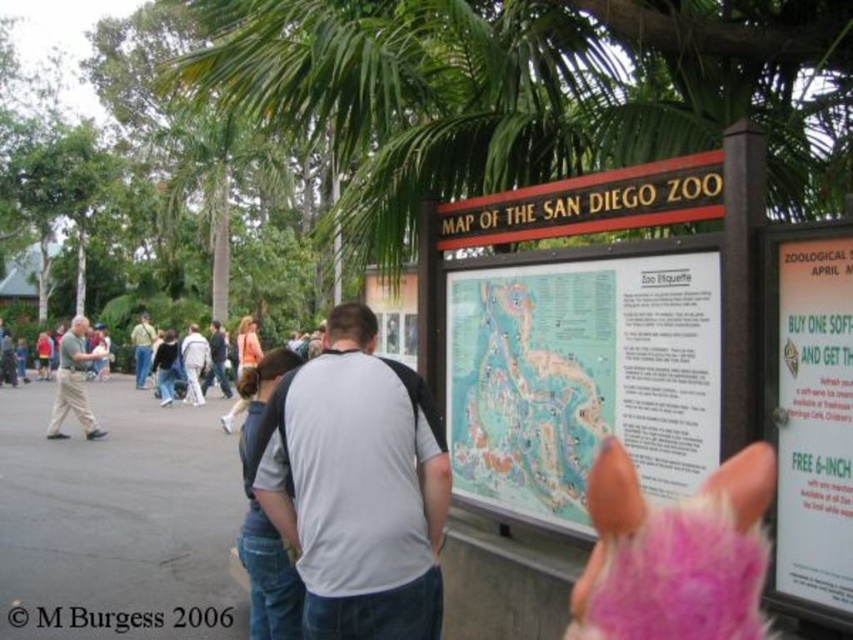
Consider the image. You are a visitor at the San Diego Zoo holding a 1.5 meter wide blanket. You want to spread it out on the ground between the map of san diego zoo at center and the gray fabric backpack at center. Will the blanket fit without overlapping either object?

The distance between the map of san diego zoo at center and the gray fabric backpack at center is 1.70 meters. Since the blanket is 1.5 meters wide, it will fit between them without overlapping either object as there is enough space.

You are standing at the San Diego Zoo and looking at the map displayed on the board. There are two points marked on the map at coordinates point (805, 435) and point (91, 420). Which of these points is closer to you?

Point (805, 435) is closer to the viewer than point (91, 420).

You are standing at the San Diego Zoo and see the map of san diego zoo at center located at point (581, 378). If you want to go to the giraffe exhibit, which is not shown in this image, should you walk towards the north or south from the map of san diego zoo at center?

The map of san diego zoo at center is located at point (581, 378). Since the giraffe exhibit is not shown here, consult the map for directions, but based on typical zoo layouts, giraffes are often located in the African savanna section which is usually north of main attractions. However, without specific map details, it is impossible to determine the exact direction.